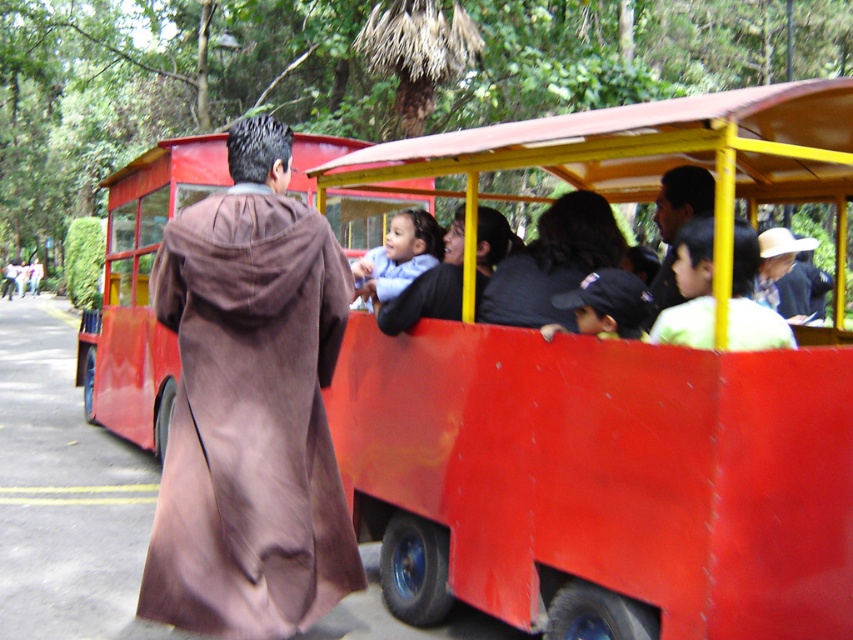
You are a passenger on the matte red bus at center and want to wave to the dark brown fabric jacket at center standing outside. Can you see them clearly from your seat?

The dark brown fabric jacket at center is behind the matte red bus at center, so you cannot see them clearly from your seat.

You are a passenger in the smooth red bus at center and want to know if you can stand up without hitting your head on the dark brown fabric jacket at center. Can you?

The smooth red bus at center is taller than dark brown fabric jacket at center, so yes, you can stand up without hitting your head on the dark brown fabric jacket at center.